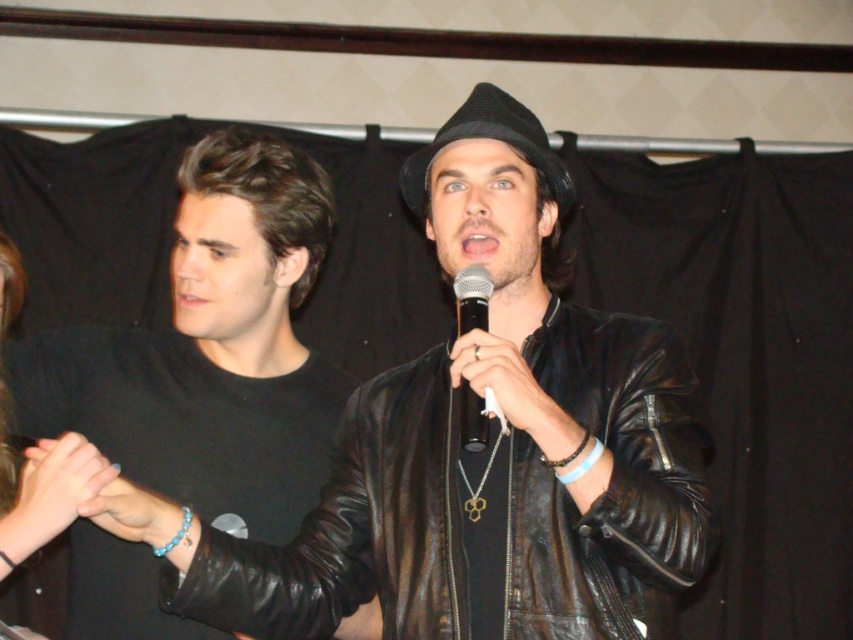
Question: Which object appears closest to the camera in this image?

Choices:
 (A) black matte leather jacket at left
 (B) black felt fedora at center

Answer: (B)

Question: Which of the following is the closest to the observer?

Choices:
 (A) black felt fedora at center
 (B) black matte leather jacket at left
 (C) black leather jacket at center

Answer: (C)

Question: Based on their relative distances, which object is farther from the black felt fedora at center?

Choices:
 (A) black matte microphone at center
 (B) black matte leather jacket at left

Answer: (B)

Question: In this image, where is black leather jacket at center located relative to black matte microphone at center?

Choices:
 (A) left
 (B) right

Answer: (A)

Question: Does black matte leather jacket at left lie behind black matte microphone at center?

Choices:
 (A) no
 (B) yes

Answer: (B)

Question: Can you confirm if black matte leather jacket at left is positioned below black felt fedora at center?

Choices:
 (A) no
 (B) yes

Answer: (B)